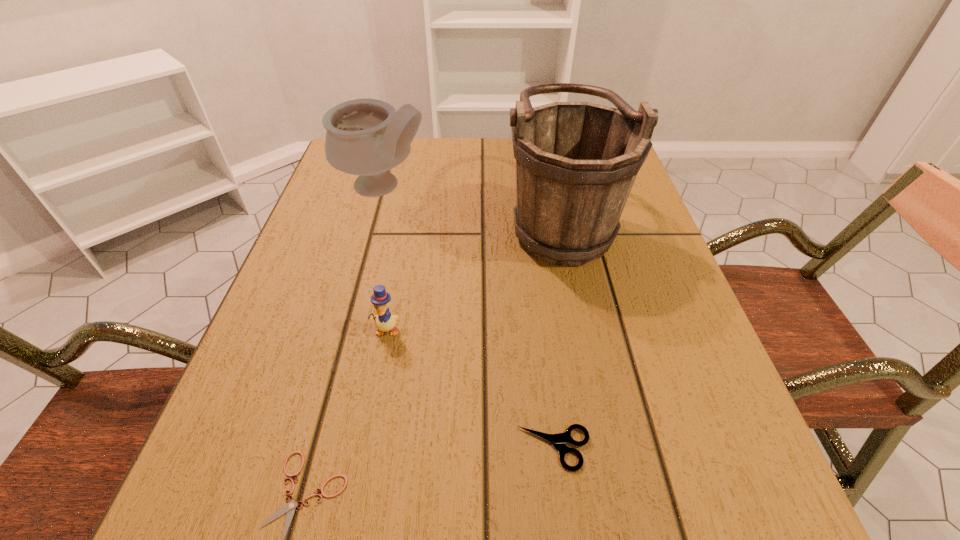
Where is `blank space located on the face of the third tallest object, where the monocle is placed`? The height and width of the screenshot is (540, 960). blank space located on the face of the third tallest object, where the monocle is placed is located at coordinates (374, 392).

This screenshot has width=960, height=540. What are the coordinates of `free space located on the left of the taller shears` in the screenshot? It's located at (286, 448).

The height and width of the screenshot is (540, 960). I want to click on bucket that is at the far edge, so click(x=576, y=162).

The width and height of the screenshot is (960, 540). In order to click on pottery that is at the far edge in this screenshot , I will do (x=367, y=137).

I want to click on object present at the left edge, so click(x=367, y=137).

The height and width of the screenshot is (540, 960). In order to click on object present at the right edge in this screenshot , I will do `click(576, 162)`.

You are a GUI agent. You are given a task and a screenshot of the screen. Output one action in this format:
    pyautogui.click(x=<x>, y=<y>)
    Task: Click on the object situated at the far left corner
    The width and height of the screenshot is (960, 540).
    Given the screenshot: What is the action you would take?
    pyautogui.click(x=367, y=137)

I want to click on object located in the far right corner section of the desktop, so click(576, 162).

This screenshot has width=960, height=540. I want to click on vacant space at the far edge, so click(431, 139).

I want to click on vacant space at the near edge of the desktop, so click(485, 482).